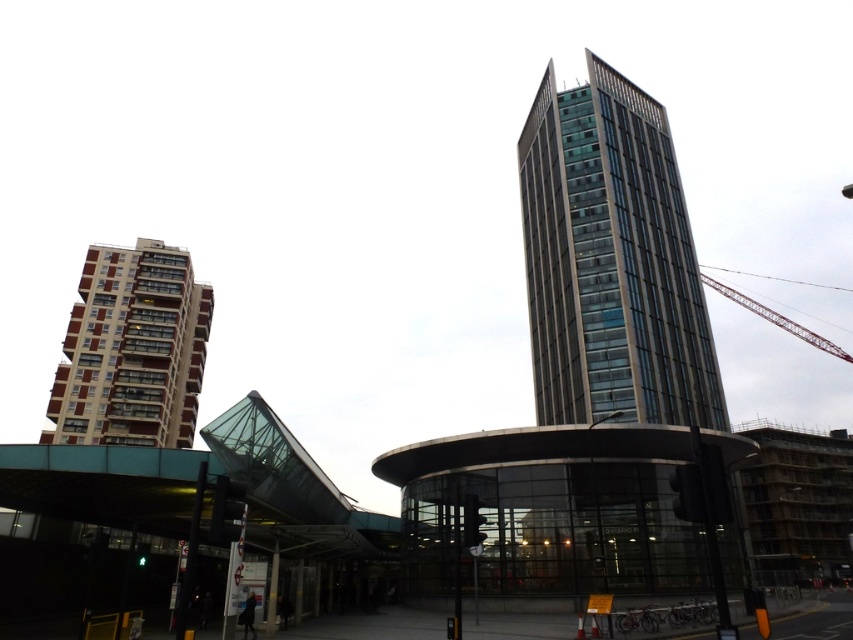
Between point (578, 403) and point (120, 410), which one is positioned behind?

Point (120, 410)

Which is in front, point (581, 291) or point (138, 372)?

Positioned in front is point (581, 291).

I want to click on glassy steel tower at upper right, so click(x=611, y=260).

Who is positioned more to the right, glassy steel tower at upper right or metallic red crane at upper right?

metallic red crane at upper right

Does glassy steel tower at upper right come behind metallic red crane at upper right?

That is False.

Is point (596, 276) positioned behind point (776, 323)?

That is False.

At what (x,y) coordinates should I click in order to perform the action: click on glassy steel tower at upper right. Please return your answer as a coordinate pair (x, y). The image size is (853, 640). Looking at the image, I should click on (611, 260).

From the picture: Measure the distance between point (192, 404) and camera.

Point (192, 404) and camera are 91.16 meters apart from each other.

Which is in front, point (85, 368) or point (759, 305)?

Positioned in front is point (85, 368).

Is point (119, 442) in front of point (717, 282)?

Yes.

Where is `beige concrete building at lower left`? The image size is (853, 640). beige concrete building at lower left is located at coordinates (132, 349).